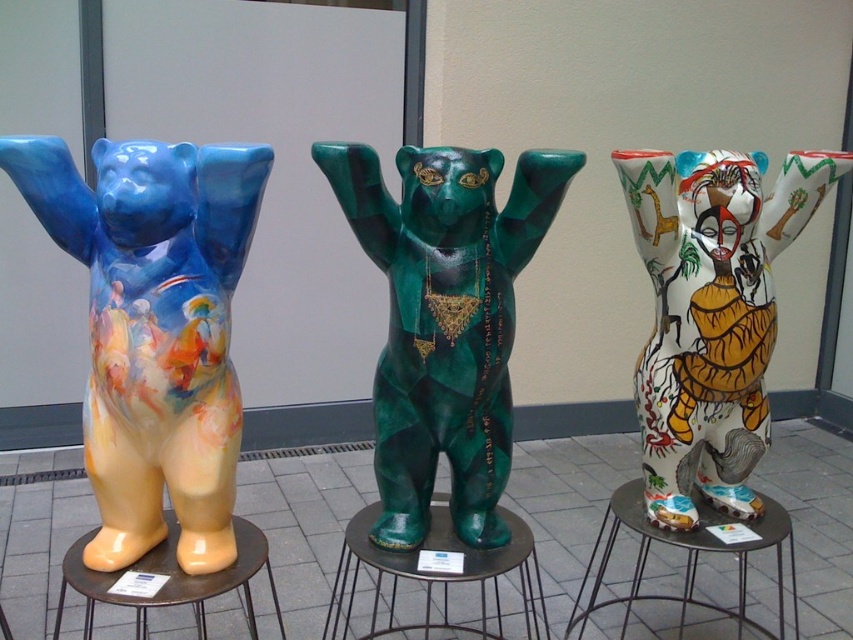
You are standing in front of the three bear sculptures. You notice two points marked on the ground at coordinates point (x=486, y=284) and point (x=740, y=316). Which point is closer to you?

Point (x=486, y=284) is in front of point (x=740, y=316), so it is closer to you.